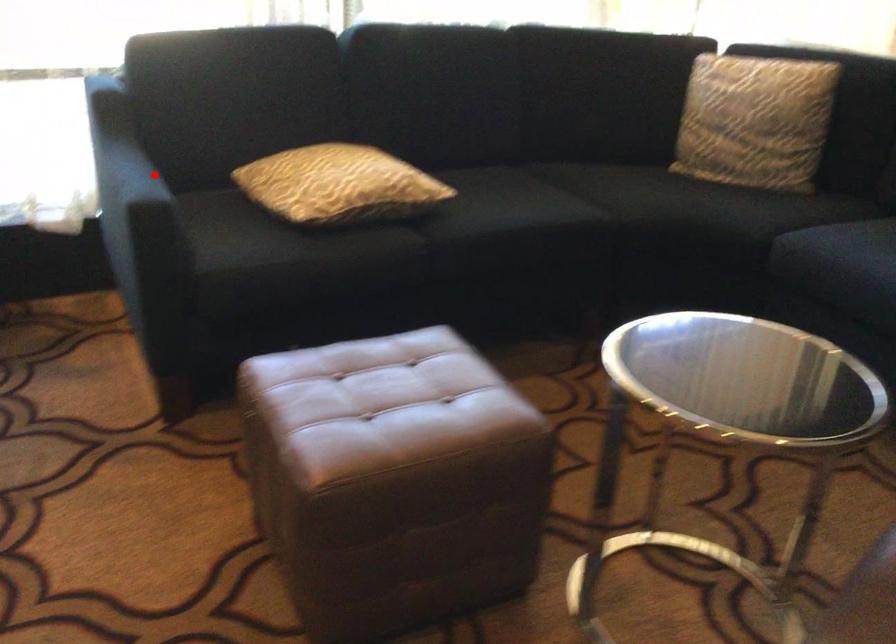
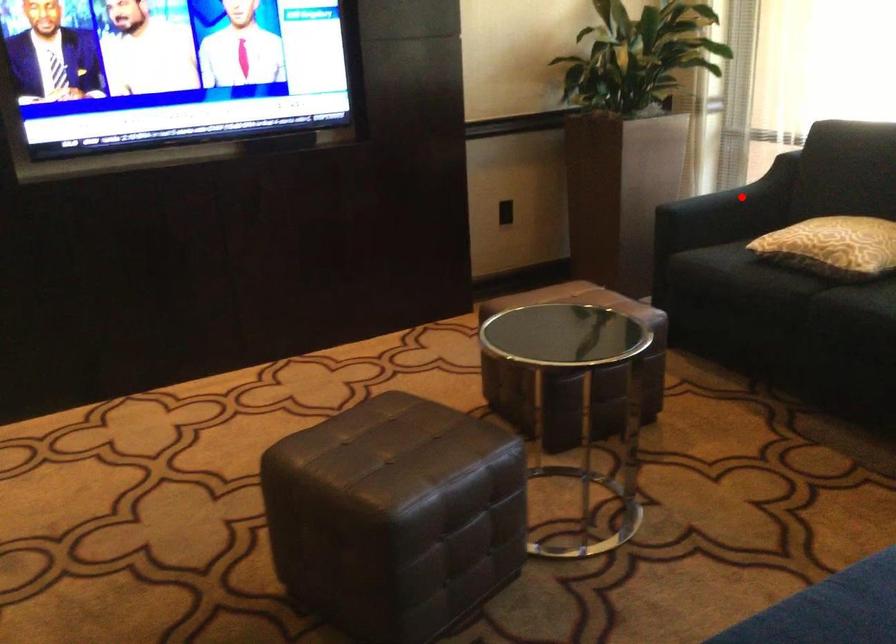
I am providing you with two images of the same scene from different viewpoints. A red point is marked on the first image and another point is marked on the second image. Do the highlighted points in image1 and image2 indicate the same real-world spot?

Yes